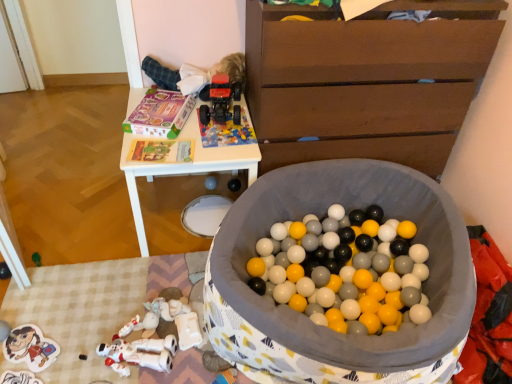
Question: Based on their positions, is matte black speaker at center, acting as the 5th toy starting from the left, located to the left or right of matte plastic sticker at lower left, which is counted as the 1th toy, starting from the left?

Choices:
 (A) right
 (B) left

Answer: (A)

Question: From the image's perspective, is matte black speaker at center, acting as the 5th toy starting from the left, located above or below matte plastic sticker at lower left, which ranks as the 6th toy in right-to-left order?

Choices:
 (A) above
 (B) below

Answer: (A)

Question: Which of these objects is positioned closest to the white matte plastic robot at lower left, the fifth toy viewed from the right?

Choices:
 (A) matte plastic sticker at lower left, which ranks as the 6th toy in right-to-left order
 (B) fluffy white baby at upper center
 (C) brown wooden chest of drawers at upper right
 (D) white plastic table at upper center
 (E) matte plastic speaker at center, placed as the third toy when sorted from left to right

Answer: (A)

Question: Which is farther from the matte black speaker at center, acting as the 5th toy starting from the left?

Choices:
 (A) matte plastic speaker at center, positioned as the fourth toy in right-to-left order
 (B) brown wooden chest of drawers at upper right
 (C) soft fabric ball pit at center, acting as the first toy starting from the right
 (D) rubberized red toy truck at upper center, which appears as the third toy when viewed from the right
 (E) white plastic table at upper center

Answer: (C)